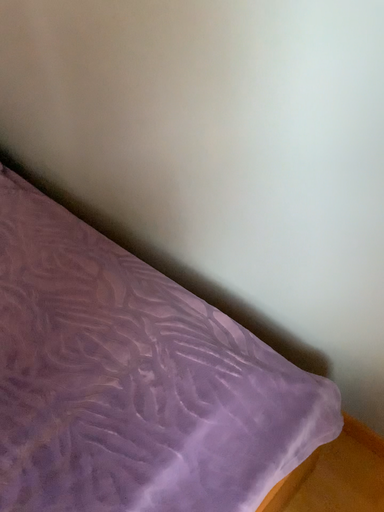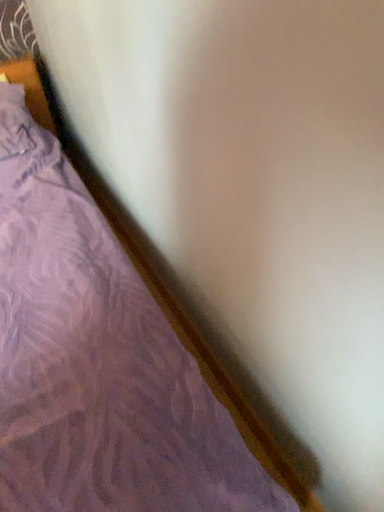
Question: How did the camera likely rotate when shooting the video?

Choices:
 (A) rotated left
 (B) rotated right

Answer: (A)